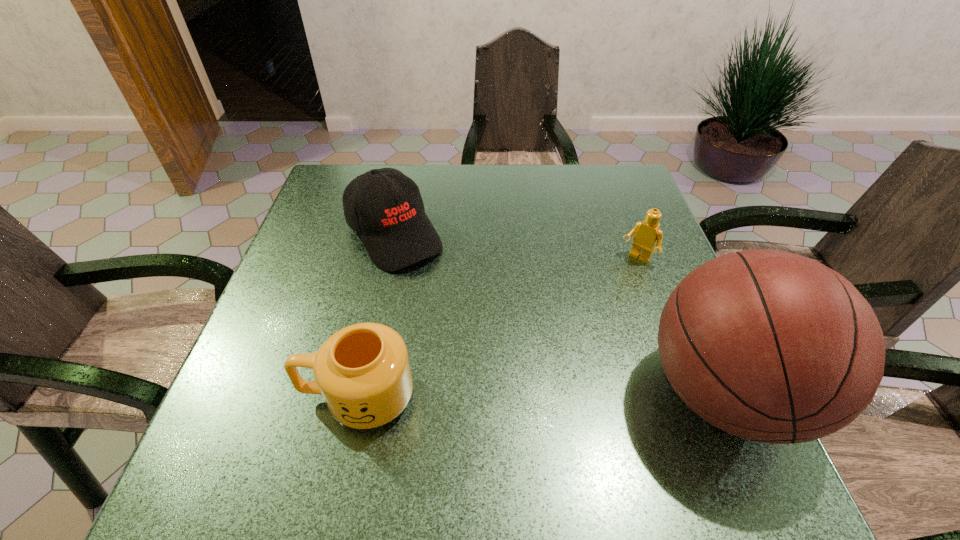
Where is `free space between the basketball and the mug`? free space between the basketball and the mug is located at coordinates (540, 395).

Identify the location of vacant space in between the tallest object and the baseball cap. The height and width of the screenshot is (540, 960). (559, 314).

This screenshot has width=960, height=540. What are the coordinates of `vacant area between the tallest object and the mug` in the screenshot? It's located at (540, 395).

At what (x,y) coordinates should I click in order to perform the action: click on free space between the baseball cap and the tallest object. Please return your answer as a coordinate pair (x, y). The height and width of the screenshot is (540, 960). Looking at the image, I should click on (559, 314).

Locate an element on the screen. This screenshot has height=540, width=960. free spot between the mug and the tallest object is located at coordinates (540, 395).

Where is `free area in between the Lego and the mug`? free area in between the Lego and the mug is located at coordinates (497, 328).

Identify which object is the third nearest to the Lego. Please provide its 2D coordinates. Your answer should be formatted as a tuple, i.e. [(x, y)], where the tuple contains the x and y coordinates of a point satisfying the conditions above.

[(363, 371)]

Identify which object is the second closest to the baseball cap. Please provide its 2D coordinates. Your answer should be formatted as a tuple, i.e. [(x, y)], where the tuple contains the x and y coordinates of a point satisfying the conditions above.

[(770, 346)]